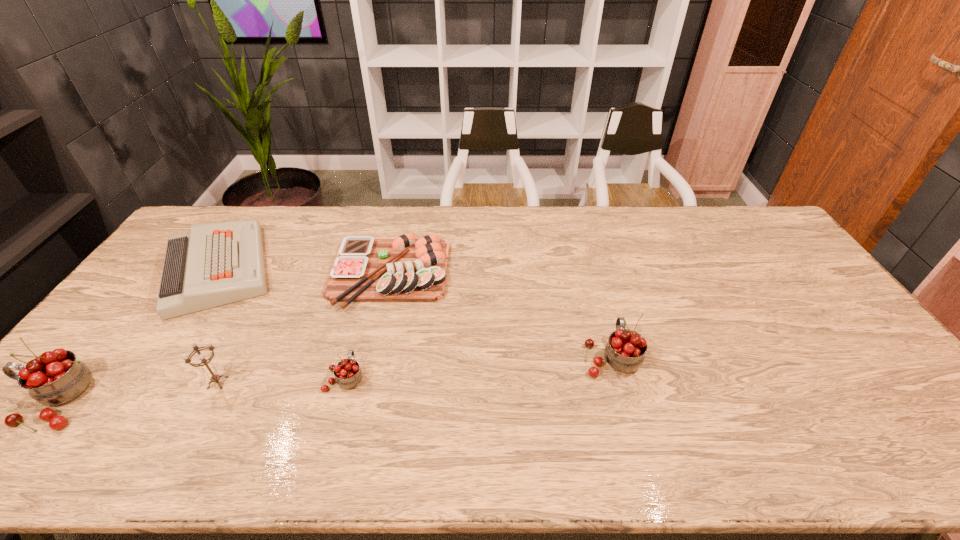
Please point a spot to add another cherry on the right. Please provide its 2D coordinates. Your answer should be formatted as a tuple, i.e. [(x, y)], where the tuple contains the x and y coordinates of a point satisfying the conditions above.

[(856, 338)]